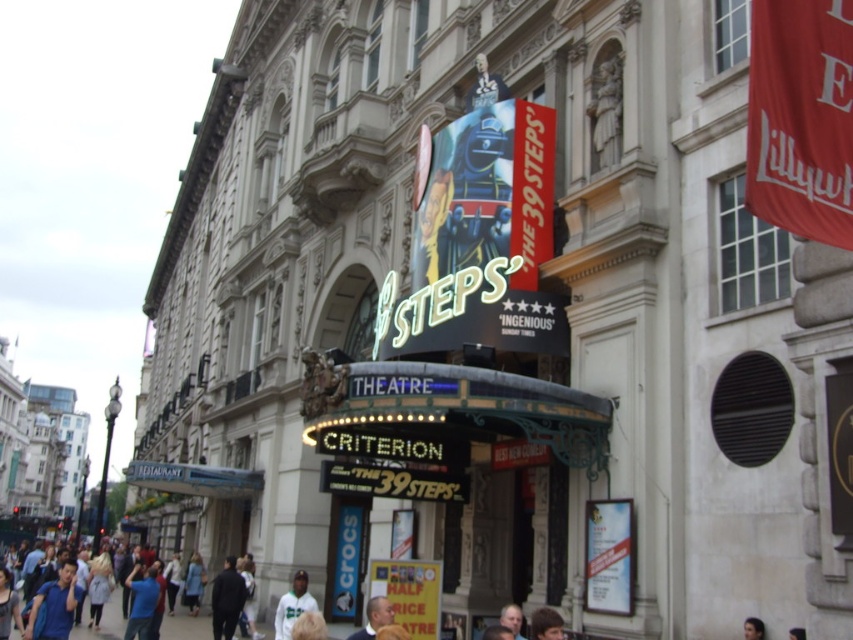
Is dark blue clothing at lower left bigger than smooth skin head at lower center?

Correct, dark blue clothing at lower left is larger in size than smooth skin head at lower center.

This screenshot has width=853, height=640. I want to click on dark blue clothing at lower left, so click(x=102, y=620).

Who is positioned more to the left, dark blue jacket at lower left or dark blue shirt at center?

dark blue jacket at lower left is more to the left.

This screenshot has height=640, width=853. What are the coordinates of `dark blue jacket at lower left` in the screenshot? It's located at (225, 600).

Is point (219, 580) behind point (355, 632)?

No, (219, 580) is closer to viewer.

Identify the location of dark blue jacket at lower left. (225, 600).

Is white matte jacket at lower center taller than dark blue shirt at lower right?

Yes, white matte jacket at lower center is taller than dark blue shirt at lower right.

Between point (281, 616) and point (752, 630), which one is positioned in front?

Point (752, 630) is in front.

Is point (300, 582) in front of point (755, 625)?

No, (300, 582) is behind (755, 625).

This screenshot has height=640, width=853. Find the location of `white matte jacket at lower center`. white matte jacket at lower center is located at coordinates (293, 605).